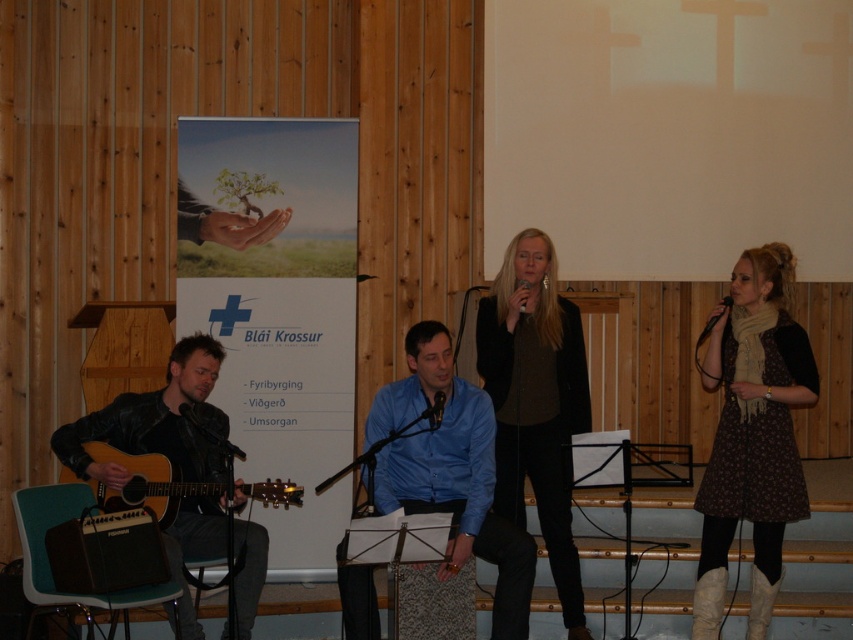
Is point (440, 403) less distant than point (701, 333)?

No, (440, 403) is further to viewer.

Is the position of black matte microphone at center less distant than that of metallic silver microphone at upper right?

No, black matte microphone at center is behind metallic silver microphone at upper right.

Identify the location of black matte microphone at center. (436, 410).

Does blue shirt at center appear over matte black microphone at center?

Incorrect, blue shirt at center is not positioned above matte black microphone at center.

Does blue shirt at center appear on the right side of matte black microphone at center?

Incorrect, blue shirt at center is not on the right side of matte black microphone at center.

Who is more distant from viewer, (473,483) or (524,305)?

The point (473,483) is more distant.

The width and height of the screenshot is (853, 640). Identify the location of blue shirt at center. (450, 472).

Which is below, black matte jacket at center or blue shirt at center?

Positioned lower is blue shirt at center.

From the picture: Does black matte jacket at center appear on the left side of blue shirt at center?

Incorrect, black matte jacket at center is not on the left side of blue shirt at center.

What do you see at coordinates (537, 403) in the screenshot? Image resolution: width=853 pixels, height=640 pixels. I see `black matte jacket at center` at bounding box center [537, 403].

Where is `black matte jacket at center`? The width and height of the screenshot is (853, 640). black matte jacket at center is located at coordinates (537, 403).